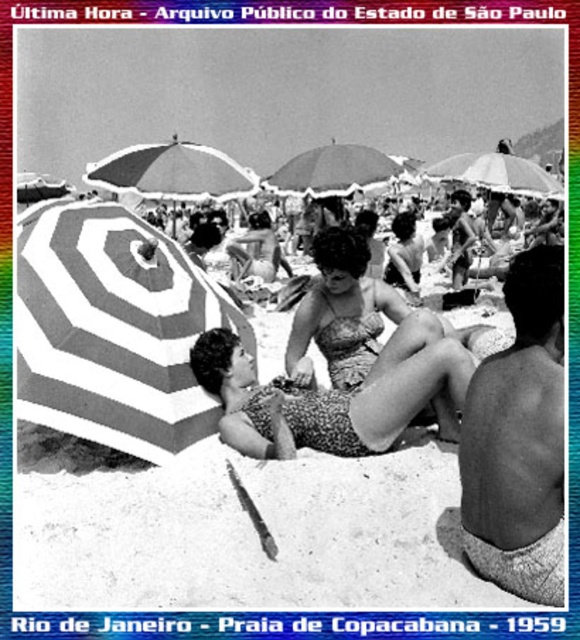
Question: Is white striped umbrella at left above white striped umbrella at center?

Choices:
 (A) yes
 (B) no

Answer: (B)

Question: Does striped fabric umbrella at left appear on the right side of printed fabric bikini at center?

Choices:
 (A) yes
 (B) no

Answer: (B)

Question: Which point is closer to the camera taking this photo?

Choices:
 (A) (531, 188)
 (B) (292, 160)
 (C) (106, 276)
 (D) (77, 209)

Answer: (C)

Question: Is striped fabric umbrella at left below printed fabric bikini at center?

Choices:
 (A) no
 (B) yes

Answer: (A)

Question: Which point is closer to the camera?

Choices:
 (A) (30, 392)
 (B) (476, 586)
 (C) (234, 429)

Answer: (B)

Question: Which object is closer to the camera taking this photo?

Choices:
 (A) white striped umbrella at center
 (B) striped fabric umbrella at left
 (C) printed fabric bikini at center
 (D) white striped umbrella at upper center

Answer: (B)